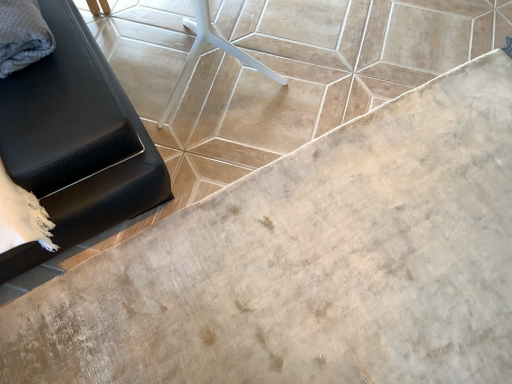
Identify the location of gray textured fabric at upper left. (22, 35).

What do you see at coordinates (22, 35) in the screenshot? This screenshot has width=512, height=384. I see `gray textured fabric at upper left` at bounding box center [22, 35].

Where is `gray textured fabric at upper left`? The image size is (512, 384). gray textured fabric at upper left is located at coordinates (x=22, y=35).